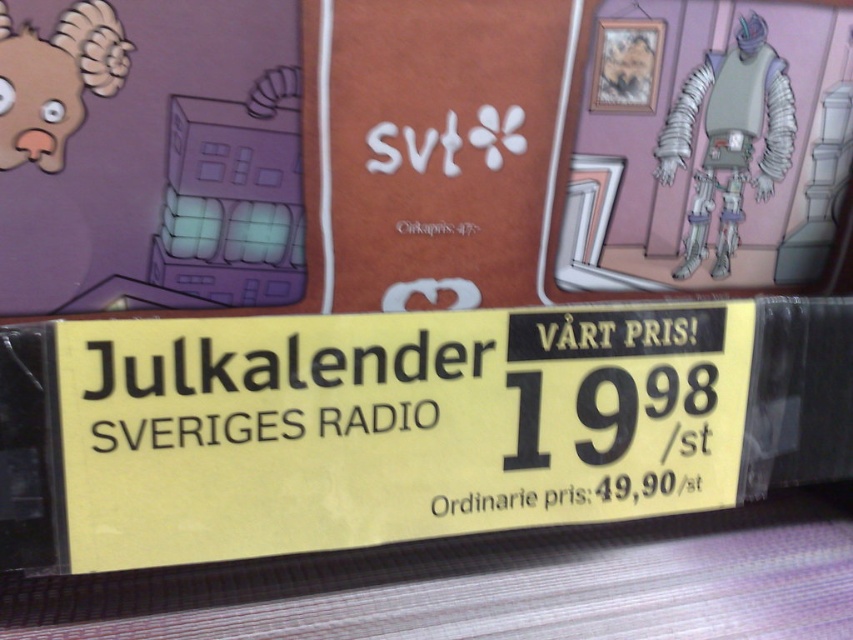
You are a customer looking at the yellow paper sign at center and the brown matte animal head at upper left in the store. Which object is nearer to you?

The yellow paper sign at center is closer to the viewer than the brown matte animal head at upper left, so the yellow paper sign at center is nearer.